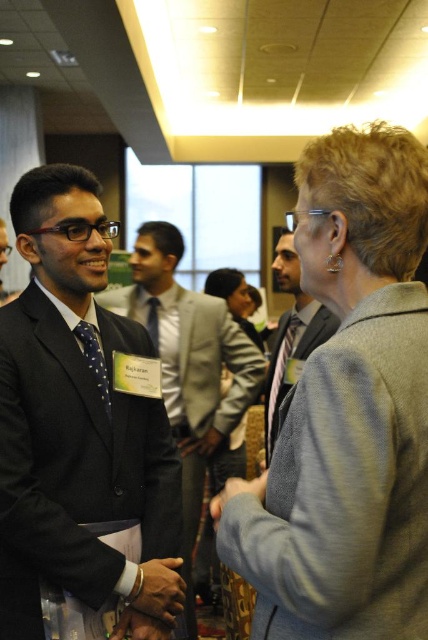
Is polka dot silk tie at left closer to the viewer compared to matte blue tie at center?

Yes.

Is polka dot silk tie at left to the right of matte blue tie at center from the viewer's perspective?

Yes, polka dot silk tie at left is to the right of matte blue tie at center.

Does point (104, 371) come in front of point (148, 316)?

Yes.

The height and width of the screenshot is (640, 428). Identify the location of polka dot silk tie at left. (95, 358).

Is light gray suit at center smaller than matte blue tie at center?

No, light gray suit at center is not smaller than matte blue tie at center.

Can you confirm if light gray suit at center is taller than matte blue tie at center?

Yes, light gray suit at center is taller than matte blue tie at center.

Who is more forward, (287, 237) or (148, 328)?

Point (287, 237) is more forward.

Find the location of a particular element. light gray suit at center is located at coordinates (291, 333).

You are a GUI agent. You are given a task and a screenshot of the screen. Output one action in this format:
    pyautogui.click(x=<x>, y=<y>)
    Task: Click on the light gray suit at center
    The width and height of the screenshot is (428, 640).
    Given the screenshot: What is the action you would take?
    pyautogui.click(x=291, y=333)

Measure the distance between point (x=297, y=292) and camera.

The distance of point (x=297, y=292) from camera is 2.39 meters.

Is point (326, 307) positioned behind point (296, 332)?

No, (326, 307) is in front of (296, 332).

I want to click on light gray suit at center, so click(x=291, y=333).